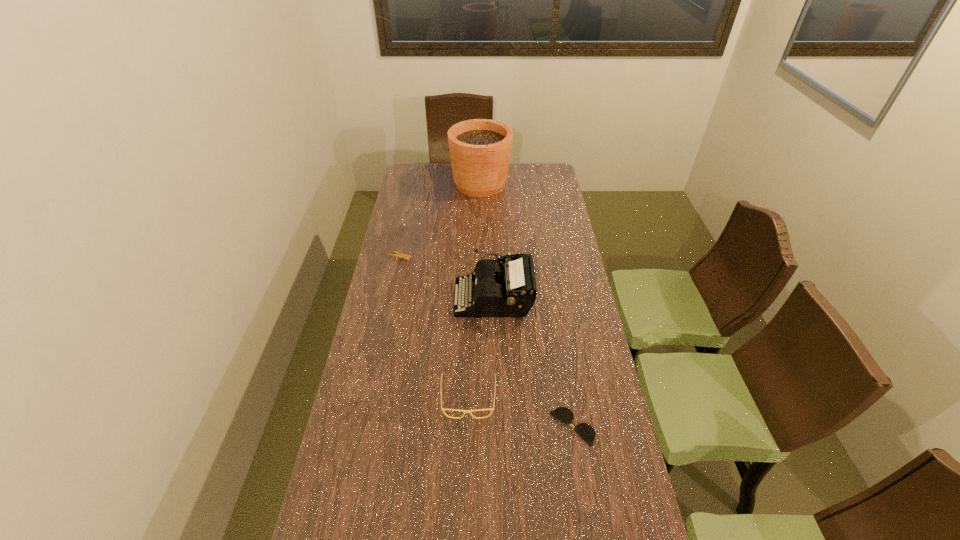
In the image, there is a desktop. What are the coordinates of `vacant area at the left edge` in the screenshot? It's located at (416, 228).

In the image, there is a desktop. Where is `free space at the right edge`? The width and height of the screenshot is (960, 540). free space at the right edge is located at coordinates (553, 208).

Find the location of a particular element. free point at the far left corner is located at coordinates (410, 171).

Where is `vacant space at the far right corner`? vacant space at the far right corner is located at coordinates (547, 178).

The height and width of the screenshot is (540, 960). Identify the location of vacant area that lies between the third nearest object and the tallest object. (487, 241).

At what (x,y) coordinates should I click in order to perform the action: click on free spot between the rightmost object and the taller spectacles. Please return your answer as a coordinate pair (x, y). Looking at the image, I should click on (520, 413).

This screenshot has height=540, width=960. Find the location of `unoccupied position between the third tallest object and the shorter spectacles`. unoccupied position between the third tallest object and the shorter spectacles is located at coordinates (520, 413).

You are a GUI agent. You are given a task and a screenshot of the screen. Output one action in this format:
    pyautogui.click(x=<x>, y=<y>)
    Task: Click on the free space between the third farthest object and the rightmost object
    
    Given the screenshot: What is the action you would take?
    [533, 362]

Locate an element on the screen. Image resolution: width=960 pixels, height=540 pixels. free point between the left spectacles and the second tallest object is located at coordinates (481, 348).

At what (x,y) coordinates should I click in order to perform the action: click on vacant region between the shorter spectacles and the third tallest object. Please return your answer as a coordinate pair (x, y). The height and width of the screenshot is (540, 960). Looking at the image, I should click on (520, 413).